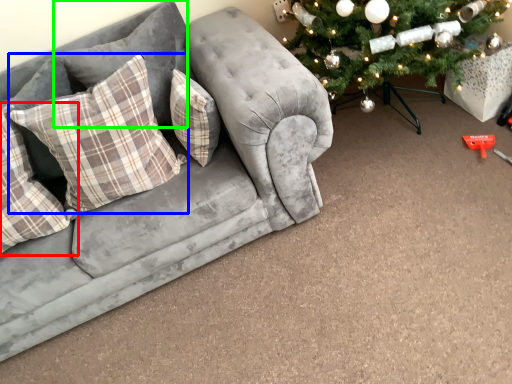
Question: Which is nearer to the pillow (highlighted by a red box)? pillow (highlighted by a blue box) or pillow (highlighted by a green box).

Choices:
 (A) pillow
 (B) pillow

Answer: (A)